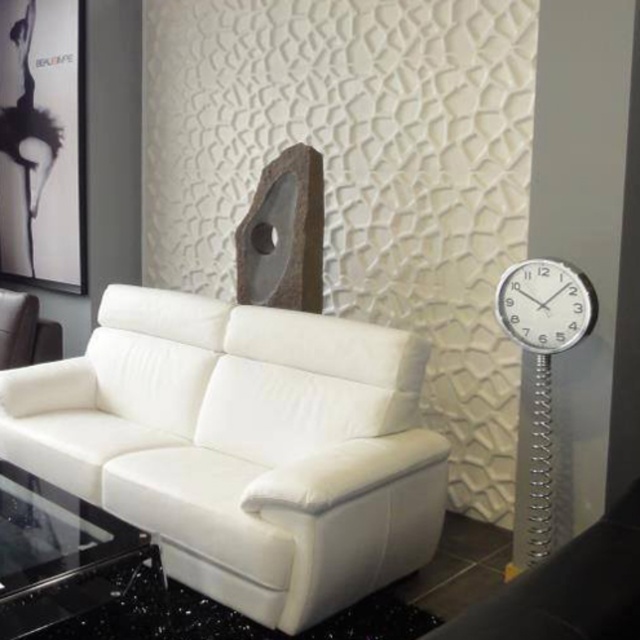
Which is more to the left, matte black picture frame at upper left or white leather armchair at left?

Positioned to the left is matte black picture frame at upper left.

Is matte black picture frame at upper left in front of white leather armchair at left?

No, matte black picture frame at upper left is behind white leather armchair at left.

Is point (58, 4) farther from camera compared to point (20, 307)?

Yes, it is behind point (20, 307).

Where is `matte black picture frame at upper left`? matte black picture frame at upper left is located at coordinates (42, 141).

Is point (150, 547) positioned before point (499, 284)?

Yes.

Is transparent glass table at lower left to the right of metallic silver clock at right from the viewer's perspective?

In fact, transparent glass table at lower left is to the left of metallic silver clock at right.

You are a GUI agent. You are given a task and a screenshot of the screen. Output one action in this format:
    pyautogui.click(x=<x>, y=<y>)
    Task: Click on the transparent glass table at lower left
    The width and height of the screenshot is (640, 640).
    Given the screenshot: What is the action you would take?
    pyautogui.click(x=61, y=556)

In the scene shown: Who is lower down, white leather couch at center or metallic silver clock at right?

Positioned lower is white leather couch at center.

Who is shorter, white leather couch at center or metallic silver clock at right?

metallic silver clock at right

Image resolution: width=640 pixels, height=640 pixels. I want to click on white leather couch at center, so click(243, 445).